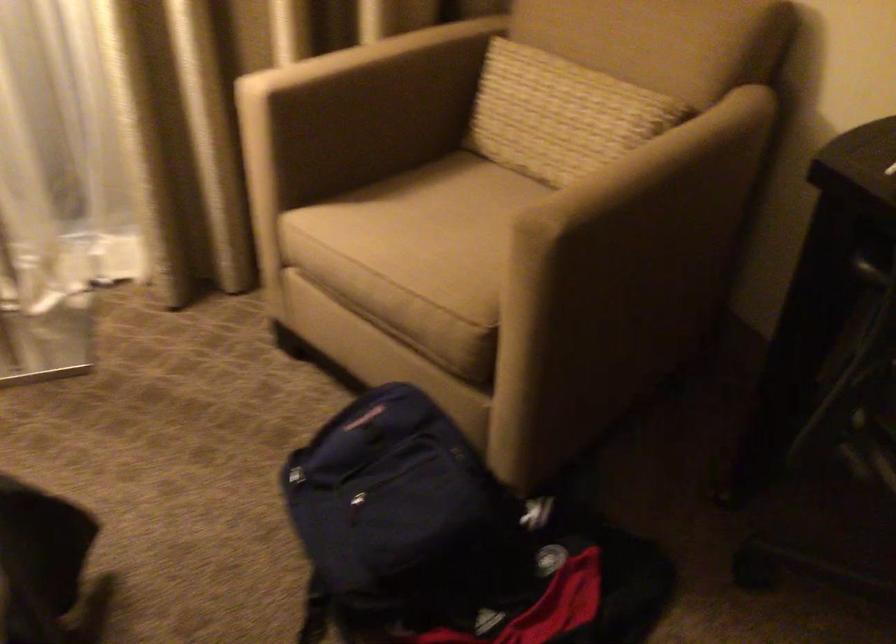
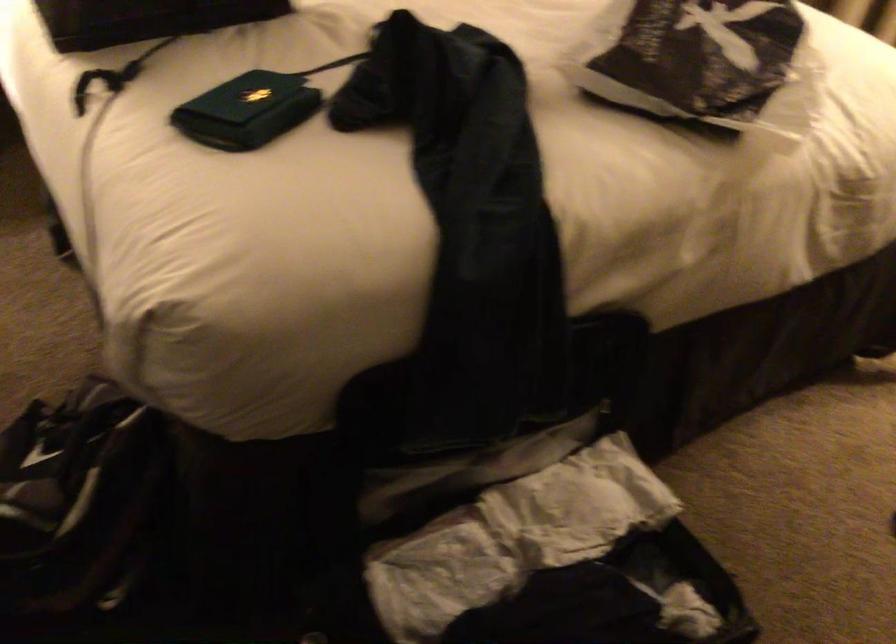
First-person continuous shooting, in which direction is the camera rotating?

The camera's rotation is toward left-down.